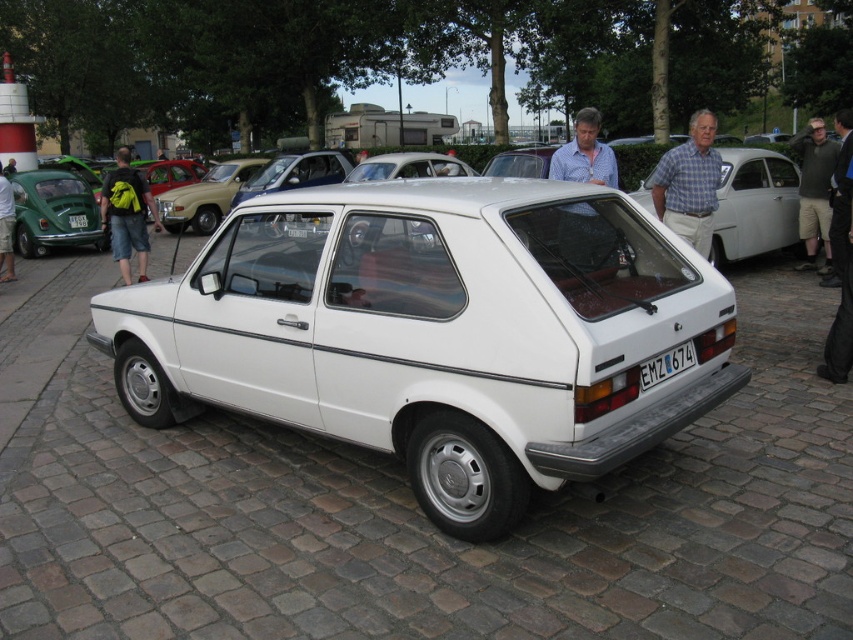
You are a delivery person who needs to place a package on the car. The package is too large to fit on the hood, so you decide to put it on the trunk. However, there is a black leather jacket at right and a white plastic license plate at rear. Which object is closer to the trunk where you should place the package?

The white plastic license plate at rear is closer to the trunk since it is positioned behind the black leather jacket at right, so place the package near the white plastic license plate at rear.

You are a delivery person standing next to the vintage white hatchback car. You need to place a package on the ground between the khaki shorts at right and the green backpack at left. Where should you place the package?

The khaki shorts at right is located below the green backpack at left, so the package should be placed between them on the ground, below the green backpack at left and above the khaki shorts at right.

You are a delivery person trying to place a package on the car. The khaki shorts at right and green backpack at left are already on the car. Which item should you move to make space for the package?

You should move the green backpack at left because the khaki shorts at right is closer to the viewer and the backpack is further back, so moving the backpack would create more space.